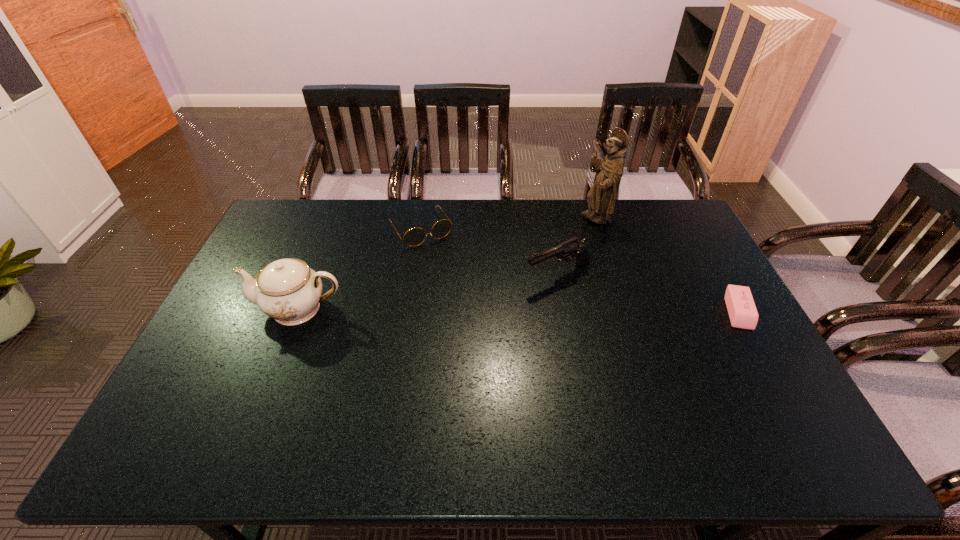
Image resolution: width=960 pixels, height=540 pixels. In order to click on free space on the desktop that is between the leftmost object and the eraser and is positioned on the lenses of the fourth tallest object in this screenshot , I will do `click(474, 310)`.

The width and height of the screenshot is (960, 540). In order to click on free spot on the desktop that is between the fourth shortest object and the shortest object and is positioned on the front-facing side of the second object from right to left in this screenshot , I will do `click(502, 310)`.

Where is `free spot on the desktop that is between the leftmost object and the shortest object and is positioned at the end of the barrel of the gun`? free spot on the desktop that is between the leftmost object and the shortest object and is positioned at the end of the barrel of the gun is located at coordinates (x=478, y=310).